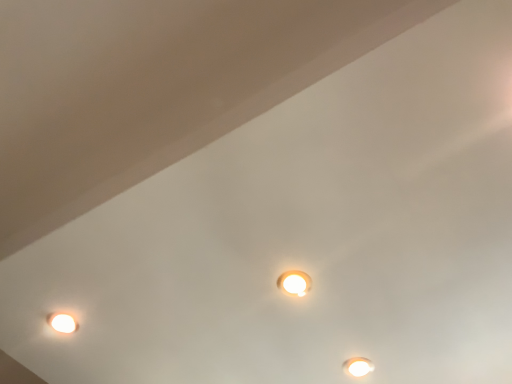
Question: Does point (345, 367) appear closer or farther from the camera than point (298, 294)?

Choices:
 (A) farther
 (B) closer

Answer: (A)

Question: From a real-world perspective, relative to white glossy lamp at center, the second lamp from the bottom, is white glossy lamp at lower right, acting as the second lamp starting from the top, vertically above or below?

Choices:
 (A) above
 (B) below

Answer: (A)

Question: Is white glossy lamp at lower right, acting as the second lamp starting from the top, wider or thinner than white glossy lamp at center, the second lamp from the bottom?

Choices:
 (A) thin
 (B) wide

Answer: (B)

Question: Is white glossy lamp at center, which is the 1th lamp from top to bottom, bigger or smaller than white glossy lamp at lower right, marked as the 1th lamp in a right-to-left arrangement?

Choices:
 (A) small
 (B) big

Answer: (A)

Question: From their relative heights in the image, would you say white glossy lamp at center, which appears as the second lamp when viewed from the back, is taller or shorter than white glossy lamp at lower right, marked as the 1th lamp in a right-to-left arrangement?

Choices:
 (A) short
 (B) tall

Answer: (A)

Question: Is point (288, 284) closer or farther from the camera than point (354, 364)?

Choices:
 (A) farther
 (B) closer

Answer: (B)

Question: In the image, is white glossy lamp at center, the second lamp from the right, on the left side or the right side of white glossy lamp at lower right, acting as the second lamp starting from the top?

Choices:
 (A) left
 (B) right

Answer: (A)